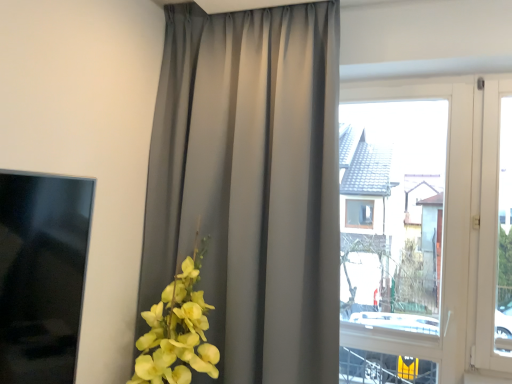
Describe the element at coordinates (251, 185) in the screenshot. The image size is (512, 384). I see `satin gray curtain at center` at that location.

The image size is (512, 384). I want to click on satin gray curtain at center, so click(x=251, y=185).

This screenshot has width=512, height=384. Describe the element at coordinates (426, 233) in the screenshot. I see `transparent glass window at center` at that location.

Find the location of `transparent glass window at center`. transparent glass window at center is located at coordinates (426, 233).

At what (x,y) coordinates should I click in order to perform the action: click on satin gray curtain at center. Please return your answer as a coordinate pair (x, y). Image resolution: width=512 pixels, height=384 pixels. Looking at the image, I should click on tap(251, 185).

Would you say transparent glass window at center is to the left or to the right of satin gray curtain at center in the picture?

Clearly, transparent glass window at center is on the right of satin gray curtain at center in the image.

Is transparent glass window at center further to the viewer compared to satin gray curtain at center?

Yes, it is behind satin gray curtain at center.

Which is behind, point (478, 94) or point (146, 279)?

Point (146, 279)

Consider the image. From the image's perspective, between transparent glass window at center and satin gray curtain at center, which one is located above?

satin gray curtain at center appears higher in the image.

Consider the image. From a real-world perspective, is transparent glass window at center located higher than satin gray curtain at center?

Actually, transparent glass window at center is physically below satin gray curtain at center in the real world.

Is transparent glass window at center thinner than satin gray curtain at center?

Correct, the width of transparent glass window at center is less than that of satin gray curtain at center.

Does transparent glass window at center have a lesser height compared to satin gray curtain at center?

Indeed, transparent glass window at center has a lesser height compared to satin gray curtain at center.

Which of these two, transparent glass window at center or satin gray curtain at center, is bigger?

With larger size is satin gray curtain at center.

Is transparent glass window at center inside or outside of satin gray curtain at center?

transparent glass window at center is spatially situated outside satin gray curtain at center.

Are transparent glass window at center and satin gray curtain at center located far from each other?

They are positioned close to each other.

Could you tell me if transparent glass window at center is turned towards satin gray curtain at center?

No, transparent glass window at center is not oriented towards satin gray curtain at center.

What's the angular difference between transparent glass window at center and satin gray curtain at center's facing directions?

The facing directions of transparent glass window at center and satin gray curtain at center are 1.01 degrees apart.

Locate an element on the screen. curtain on the left side of transparent glass window at center is located at coordinates (251, 185).

Looking at this image, is satin gray curtain at center at the left side of transparent glass window at center?

Yes, satin gray curtain at center is to the left of transparent glass window at center.

Considering the relative positions of satin gray curtain at center and transparent glass window at center in the image provided, is satin gray curtain at center in front of transparent glass window at center?

Yes, satin gray curtain at center is in front of transparent glass window at center.

Which is farther, [259,245] or [474,143]?

The point [474,143] is farther from the camera.

From the picture: From the image's perspective, is satin gray curtain at center located above or below transparent glass window at center?

satin gray curtain at center is above transparent glass window at center.

From a real-world perspective, is satin gray curtain at center beneath transparent glass window at center?

No, from a real-world perspective, satin gray curtain at center is not under transparent glass window at center.

Is satin gray curtain at center thinner than transparent glass window at center?

No.

Which of these two, satin gray curtain at center or transparent glass window at center, stands shorter?

With less height is transparent glass window at center.

Does satin gray curtain at center have a smaller size compared to transparent glass window at center?

Incorrect, satin gray curtain at center is not smaller in size than transparent glass window at center.

Is satin gray curtain at center located outside transparent glass window at center?

satin gray curtain at center is positioned outside transparent glass window at center.

Is there a large distance between satin gray curtain at center and transparent glass window at center?

satin gray curtain at center is actually quite close to transparent glass window at center.

Is satin gray curtain at center looking in the opposite direction of transparent glass window at center?

satin gray curtain at center does not have its back to transparent glass window at center.

At what (x,y) coordinates should I click in order to perform the action: click on window on the right of satin gray curtain at center. Please return your answer as a coordinate pair (x, y). This screenshot has width=512, height=384. Looking at the image, I should click on (426, 233).

The image size is (512, 384). I want to click on window below the satin gray curtain at center (from the image's perspective), so [426, 233].

Image resolution: width=512 pixels, height=384 pixels. I want to click on curtain in front of the transparent glass window at center, so click(251, 185).